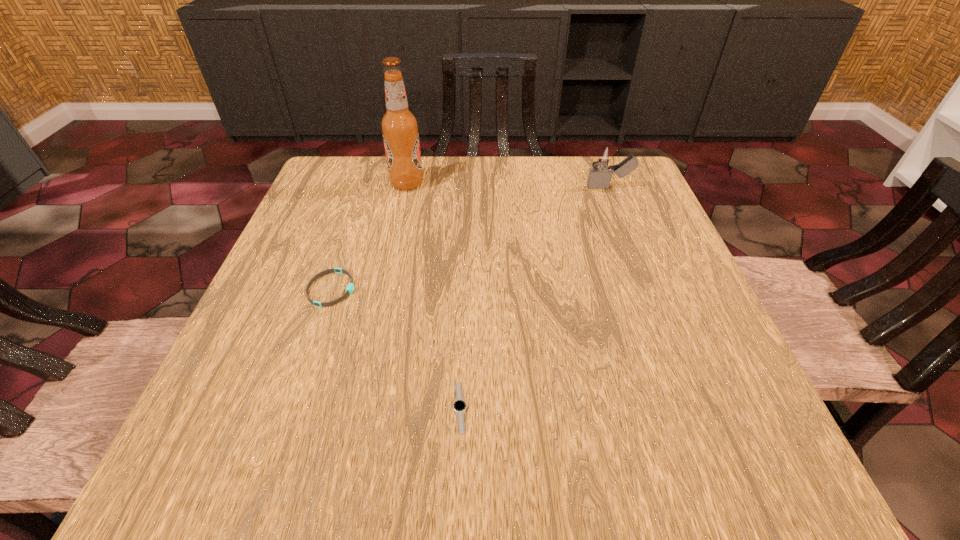
Locate an element on the screen. The width and height of the screenshot is (960, 540). free space that satisfies the following two spatial constraints: 1. on the front label of the second object from left to right; 2. on the left side of the igniter is located at coordinates (406, 187).

You are a GUI agent. You are given a task and a screenshot of the screen. Output one action in this format:
    pyautogui.click(x=<x>, y=<y>)
    Task: Click on the vacant space that satisfies the following two spatial constraints: 1. on the buckle of the third object from left to right; 2. on the right side of the wristband
    
    Given the screenshot: What is the action you would take?
    pyautogui.click(x=292, y=407)

Identify the location of free location that satisfies the following two spatial constraints: 1. on the buckle of the second shortest object; 2. on the back side of the shortest object. (292, 407).

Identify the location of free spot that satisfies the following two spatial constraints: 1. on the buckle of the third tallest object; 2. on the left side of the nearest object. This screenshot has height=540, width=960. (292, 407).

At what (x,y) coordinates should I click in order to perform the action: click on vacant space that satisfies the following two spatial constraints: 1. on the front label of the beer bottle; 2. on the back side of the watch. Please return your answer as a coordinate pair (x, y). The image size is (960, 540). Looking at the image, I should click on (358, 407).

The image size is (960, 540). What are the coordinates of `free space that satisfies the following two spatial constraints: 1. on the front side of the third shortest object; 2. on the buckle of the leftmost object` in the screenshot? It's located at (648, 289).

Locate an element on the screen. vacant space that satisfies the following two spatial constraints: 1. on the buckle of the leftmost object; 2. on the right side of the shortest object is located at coordinates (292, 407).